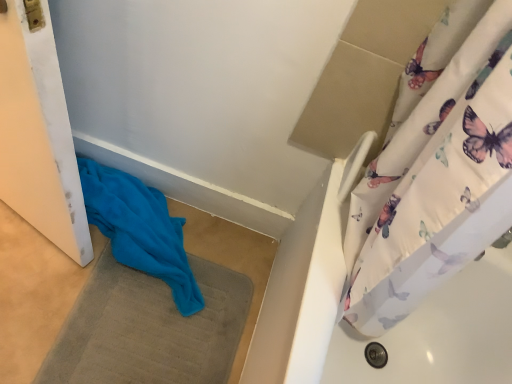
Question: Does point (76, 354) appear closer or farther from the camera than point (108, 218)?

Choices:
 (A) closer
 (B) farther

Answer: (A)

Question: In terms of width, does blue fabric bath mat at lower left look wider or thinner when compared to blue soft towel at lower left?

Choices:
 (A) thin
 (B) wide

Answer: (B)

Question: From the image's perspective, is blue fabric bath mat at lower left positioned above or below blue soft towel at lower left?

Choices:
 (A) below
 (B) above

Answer: (A)

Question: Based on their sizes in the image, would you say blue soft towel at lower left is bigger or smaller than blue fabric bath mat at lower left?

Choices:
 (A) big
 (B) small

Answer: (A)

Question: From the image's perspective, relative to blue fabric bath mat at lower left, is blue soft towel at lower left above or below?

Choices:
 (A) below
 (B) above

Answer: (B)

Question: Is blue soft towel at lower left inside or outside of blue fabric bath mat at lower left?

Choices:
 (A) inside
 (B) outside

Answer: (B)

Question: Considering the positions of blue soft towel at lower left and blue fabric bath mat at lower left in the image, is blue soft towel at lower left taller or shorter than blue fabric bath mat at lower left?

Choices:
 (A) tall
 (B) short

Answer: (A)